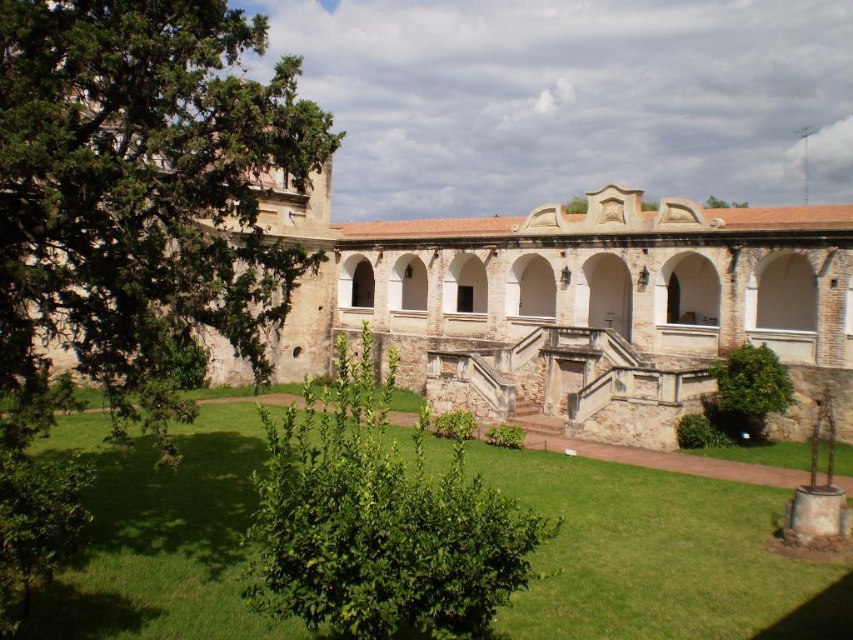
Question: Is brown stone building at center above green leafy bush at center?

Choices:
 (A) no
 (B) yes

Answer: (B)

Question: Among these points, which one is farthest from the camera?

Choices:
 (A) (730, 408)
 (B) (607, 538)
 (C) (73, 227)

Answer: (A)

Question: Which object is the farthest from the green leafy tree at lower right?

Choices:
 (A) green leafy bush at center
 (B) brown stone building at center
 (C) green leafy tree at left

Answer: (C)

Question: Which is nearer to the green grass at center?

Choices:
 (A) brown stone building at center
 (B) green leafy tree at left
 (C) green leafy tree at lower right
 (D) green leafy bush at center

Answer: (D)

Question: Does brown stone building at center appear on the right side of green grass at center?

Choices:
 (A) no
 (B) yes

Answer: (B)

Question: Can you confirm if brown stone building at center is thinner than green leafy tree at left?

Choices:
 (A) yes
 (B) no

Answer: (B)